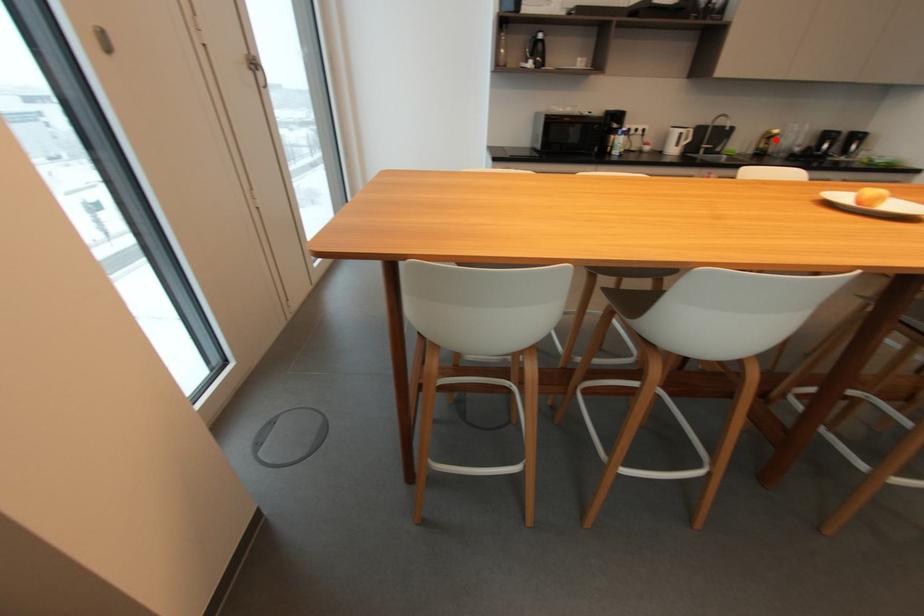
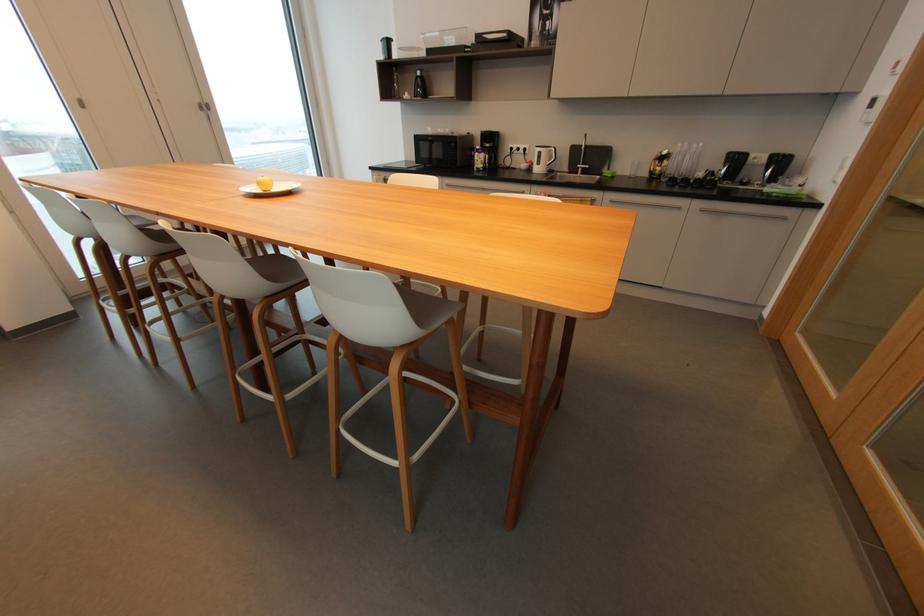
In the second image, find the point that corresponds to the highlighted location in the first image.

(669, 161)